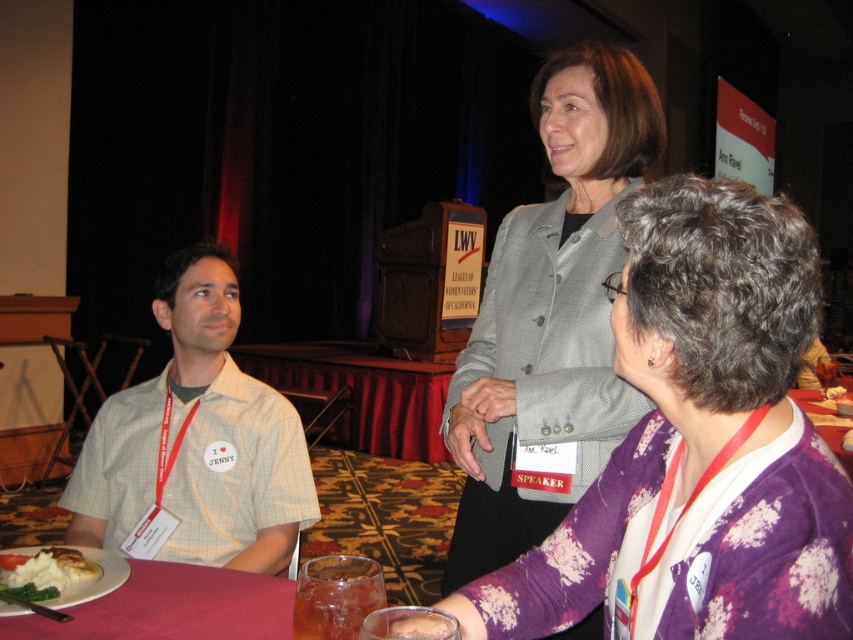
Question: Among these points, which one is nearest to the camera?

Choices:
 (A) (395, 369)
 (B) (657, 234)
 (C) (42, 582)
 (D) (468, 568)

Answer: (B)

Question: Which point is farther to the camera?

Choices:
 (A) gray fabric jacket at upper center
 (B) red fabric table at center

Answer: (B)

Question: Does gray fabric jacket at upper center have a larger size compared to beige checkered shirt at left?

Choices:
 (A) no
 (B) yes

Answer: (B)

Question: Which of these objects is positioned closest to the beige checkered shirt at left?

Choices:
 (A) gray fabric jacket at upper center
 (B) red fabric table at center
 (C) white mashed potato at lower left

Answer: (C)

Question: Is beige checkered shirt at left bigger than red fabric table at center?

Choices:
 (A) yes
 (B) no

Answer: (B)

Question: Is gray textured blazer at upper center bigger than white mashed potato at lower left?

Choices:
 (A) yes
 (B) no

Answer: (A)